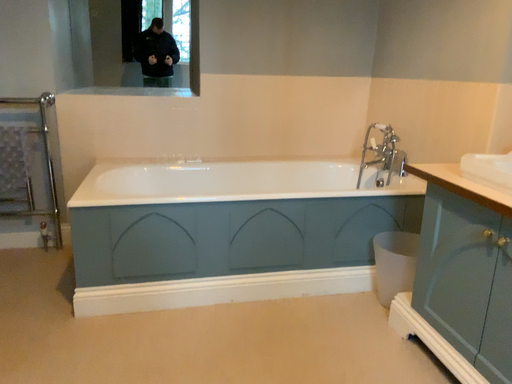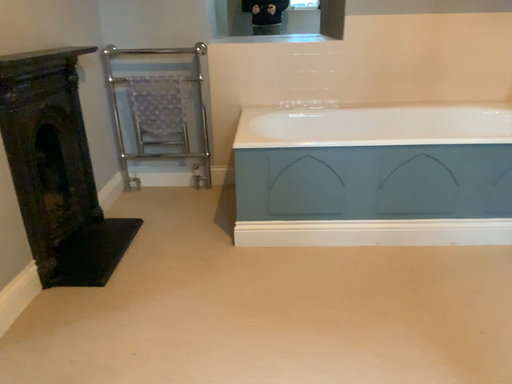
Question: How did the camera likely rotate when shooting the video?

Choices:
 (A) rotated downward
 (B) rotated upward

Answer: (A)